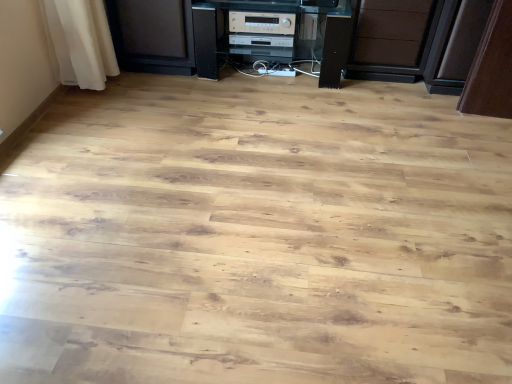
Question: Is silver metallic stereo at center, acting as the 1th appliance starting from the front, wider or thinner than silver metallic stereo at center, the second appliance in the front-to-back sequence?

Choices:
 (A) thin
 (B) wide

Answer: (A)

Question: From their relative heights in the image, would you say silver metallic stereo at center, the second appliance viewed from the back, is taller or shorter than silver metallic stereo at center, positioned as the first appliance in back-to-front order?

Choices:
 (A) tall
 (B) short

Answer: (A)

Question: Which object is the farthest from the black plastic stereo at center?

Choices:
 (A) silver metallic stereo at center, the second appliance in the front-to-back sequence
 (B) silver metallic stereo at center, the second appliance viewed from the back
 (C) brown matte drawer at center

Answer: (C)

Question: Estimate the real-world distances between objects in this image. Which object is closer to the black plastic stereo at center?

Choices:
 (A) silver metallic stereo at center, positioned as the first appliance in back-to-front order
 (B) brown matte drawer at center
 (C) silver metallic stereo at center, acting as the 1th appliance starting from the front

Answer: (A)